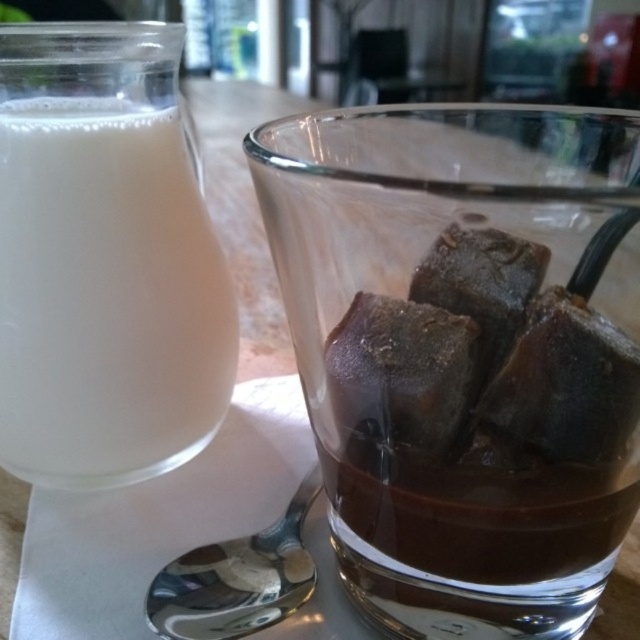
Is dark chocolate cube at center shorter than satin silver spoon at lower center?

No, dark chocolate cube at center is not shorter than satin silver spoon at lower center.

This screenshot has width=640, height=640. What do you see at coordinates (401, 378) in the screenshot?
I see `dark chocolate cube at center` at bounding box center [401, 378].

The image size is (640, 640). In order to click on dark chocolate cube at center in this screenshot , I will do `click(401, 378)`.

Which is more to the left, white opaque liquid at left or dark chocolate cube at center?

From the viewer's perspective, white opaque liquid at left appears more on the left side.

The width and height of the screenshot is (640, 640). Describe the element at coordinates (106, 300) in the screenshot. I see `white opaque liquid at left` at that location.

Locate an element on the screen. The height and width of the screenshot is (640, 640). white opaque liquid at left is located at coordinates (106, 300).

Is white opaque liquid at left bigger than satin silver spoon at lower center?

Indeed, white opaque liquid at left has a larger size compared to satin silver spoon at lower center.

Does white opaque liquid at left have a smaller size compared to satin silver spoon at lower center?

Incorrect, white opaque liquid at left is not smaller in size than satin silver spoon at lower center.

Measure the distance between point (106,449) and camera.

The distance of point (106,449) from camera is 7.63 inches.

You are a GUI agent. You are given a task and a screenshot of the screen. Output one action in this format:
    pyautogui.click(x=<x>, y=<y>)
    Task: Click on the white opaque liquid at left
    The image size is (640, 640).
    Given the screenshot: What is the action you would take?
    pyautogui.click(x=106, y=300)